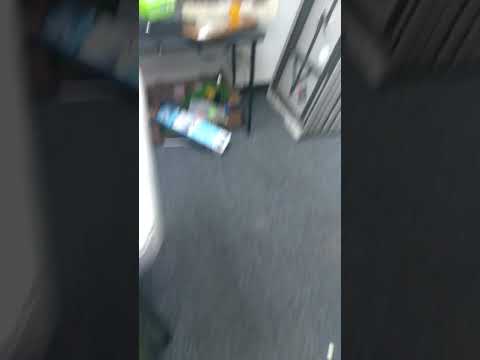
What are the coordinates of `box` in the screenshot? It's located at (186, 119).